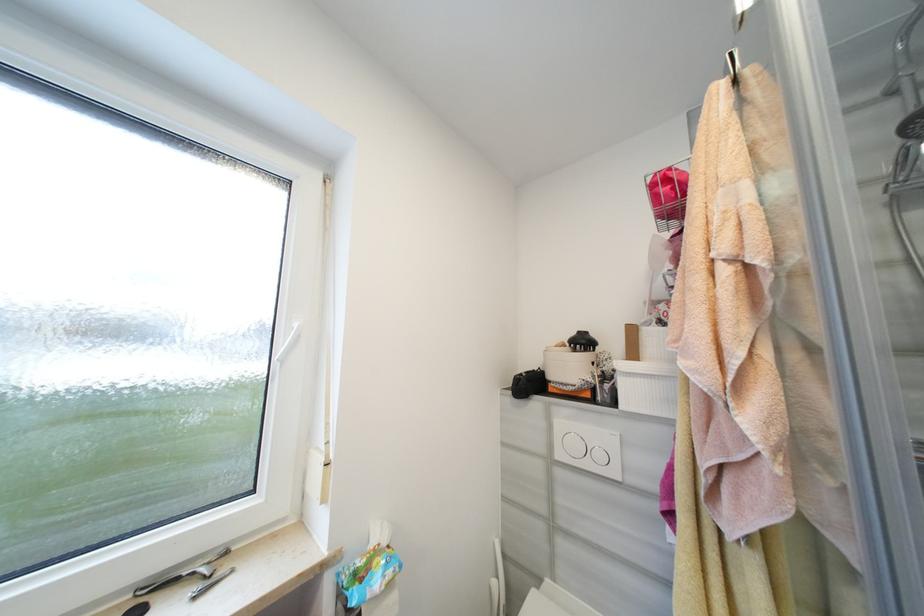
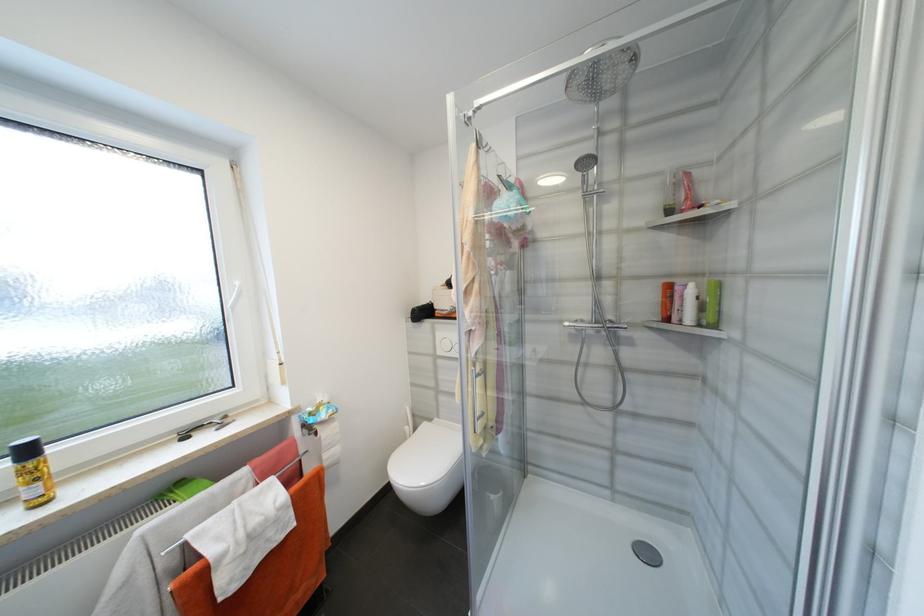
The point at (x=301, y=326) is marked in the first image. Where is the corresponding point in the second image?

(242, 285)